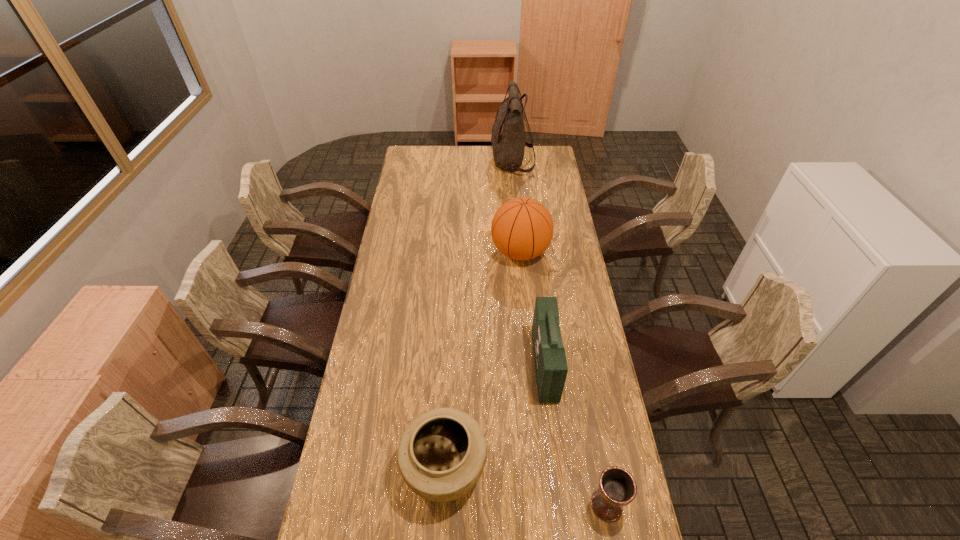
This screenshot has width=960, height=540. What are the coordinates of `free space located on the left of the second farthest object` in the screenshot? It's located at (413, 252).

Locate an element on the screen. The height and width of the screenshot is (540, 960). free space located 0.250m on the front-facing side of the first-aid kit is located at coordinates (462, 366).

Where is `free location located 0.200m on the front-facing side of the first-aid kit`? free location located 0.200m on the front-facing side of the first-aid kit is located at coordinates (477, 366).

In order to click on free space located on the front-facing side of the first-aid kit in this screenshot , I will do coord(459,366).

Find the location of a particular element. The height and width of the screenshot is (540, 960). vacant region located 0.080m on the left of the pottery is located at coordinates (375, 468).

Locate an element on the screen. This screenshot has height=540, width=960. vacant space situated on the left of the chalice is located at coordinates (473, 505).

This screenshot has height=540, width=960. I want to click on object that is at the far edge, so click(508, 143).

The height and width of the screenshot is (540, 960). I want to click on backpack located at the right edge, so click(x=508, y=143).

You are a GUI agent. You are given a task and a screenshot of the screen. Output one action in this format:
    pyautogui.click(x=<x>, y=<y>)
    Task: Click on the basketball located in the right edge section of the desktop
    
    Given the screenshot: What is the action you would take?
    pyautogui.click(x=522, y=228)

The image size is (960, 540). What are the coordinates of `the first-aid kit located in the right edge section of the desktop` in the screenshot? It's located at (551, 368).